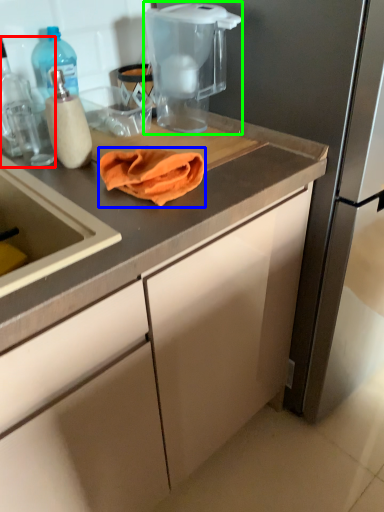
Question: Which is farther away from kitchen appliance (highlighted by a red box)? blanket (highlighted by a blue box) or home appliance (highlighted by a green box)?

Choices:
 (A) blanket
 (B) home appliance

Answer: (B)